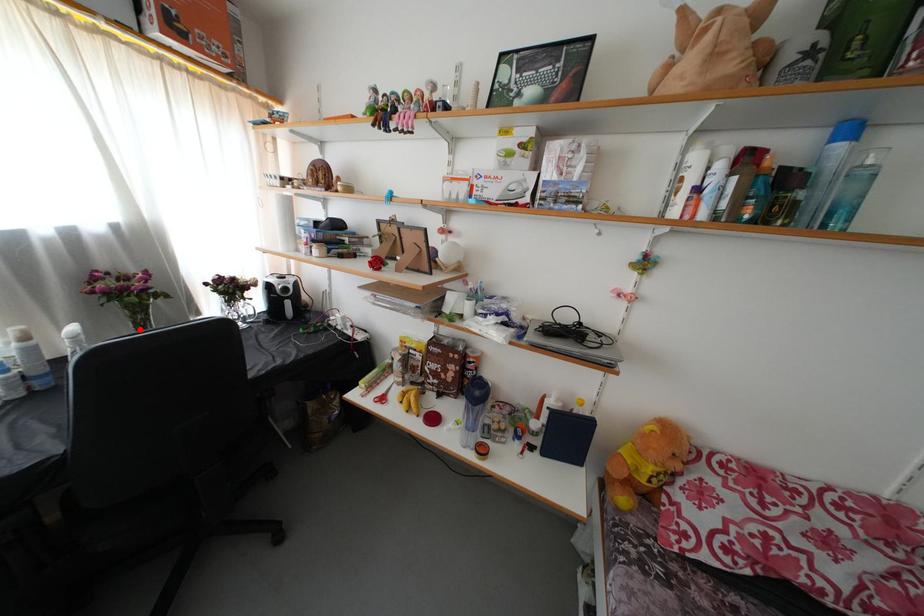
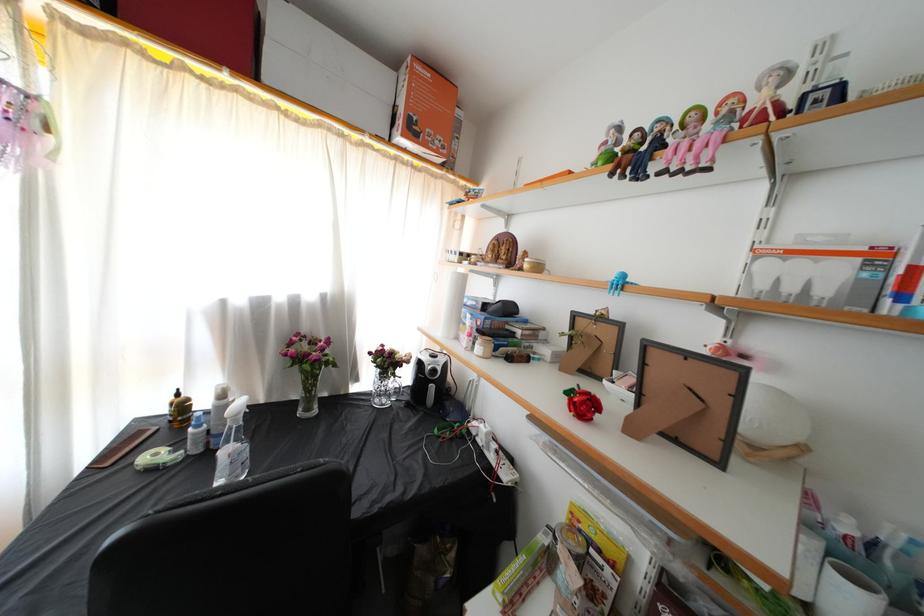
Where in the second image is the point corresponding to the highlighted location from the first image?

(310, 392)